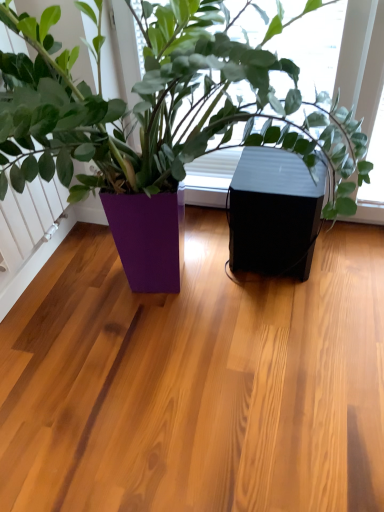
Question: Is purple glossy planter at center bigger than black matte speaker at center?

Choices:
 (A) no
 (B) yes

Answer: (B)

Question: Considering the relative positions of purple glossy planter at center and black matte speaker at center in the image provided, is purple glossy planter at center to the left of black matte speaker at center from the viewer's perspective?

Choices:
 (A) no
 (B) yes

Answer: (B)

Question: Is purple glossy planter at center shorter than black matte speaker at center?

Choices:
 (A) no
 (B) yes

Answer: (A)

Question: From a real-world perspective, is purple glossy planter at center located beneath black matte speaker at center?

Choices:
 (A) yes
 (B) no

Answer: (B)

Question: Is purple glossy planter at center closer to camera compared to black matte speaker at center?

Choices:
 (A) no
 (B) yes

Answer: (B)

Question: Is purple glossy planter at center in contact with black matte speaker at center?

Choices:
 (A) no
 (B) yes

Answer: (A)

Question: Can you confirm if black matte speaker at center is smaller than purple glossy planter at center?

Choices:
 (A) no
 (B) yes

Answer: (B)

Question: Is black matte speaker at center taller than purple glossy planter at center?

Choices:
 (A) yes
 (B) no

Answer: (B)

Question: From a real-world perspective, is black matte speaker at center over purple glossy planter at center?

Choices:
 (A) no
 (B) yes

Answer: (A)

Question: Is black matte speaker at center aimed at purple glossy planter at center?

Choices:
 (A) no
 (B) yes

Answer: (B)

Question: Does black matte speaker at center appear on the right side of purple glossy planter at center?

Choices:
 (A) yes
 (B) no

Answer: (A)

Question: From the image's perspective, is black matte speaker at center under purple glossy planter at center?

Choices:
 (A) yes
 (B) no

Answer: (A)

Question: Visually, is black matte speaker at center positioned to the left or to the right of purple glossy planter at center?

Choices:
 (A) right
 (B) left

Answer: (A)